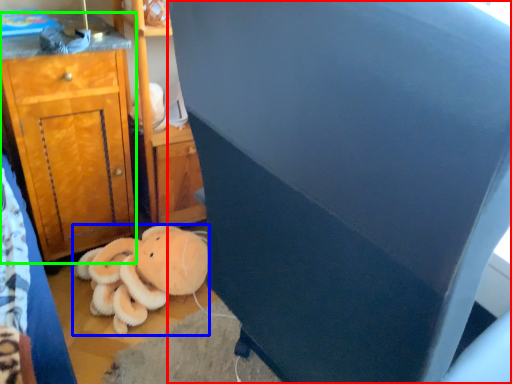
Question: Which object is positioned closest to furniture (highlighted by a red box)? Select from teddy bear (highlighted by a blue box) and cabinetry (highlighted by a green box).

Choices:
 (A) teddy bear
 (B) cabinetry

Answer: (A)